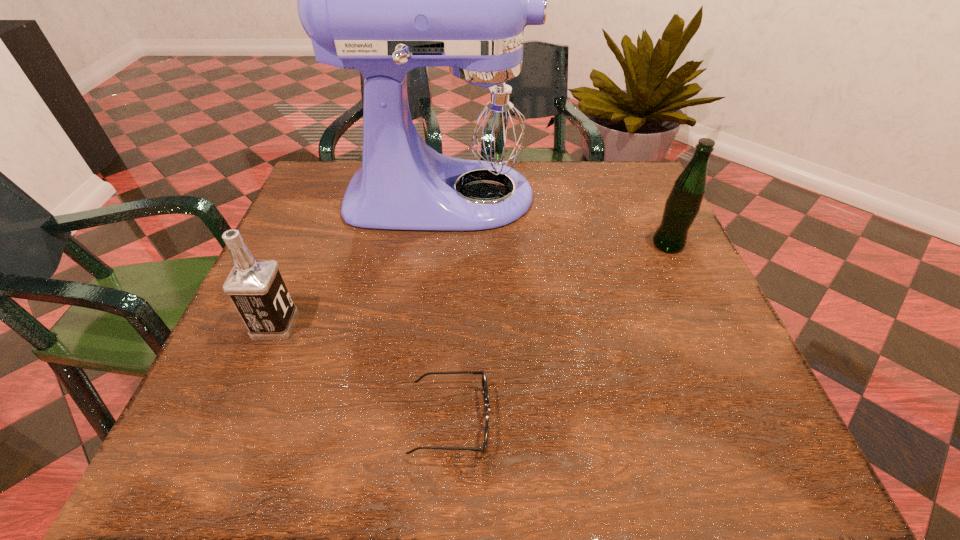
Identify the location of object located in the far edge section of the desktop. This screenshot has height=540, width=960. (383, 0).

Find the location of a particular element. object located in the near edge section of the desktop is located at coordinates (484, 381).

Identify the location of mixer positioned at the left edge. This screenshot has height=540, width=960. (383, 0).

This screenshot has height=540, width=960. What are the coordinates of `vodka present at the left edge` in the screenshot? It's located at point(256,288).

This screenshot has width=960, height=540. In order to click on object present at the right edge in this screenshot , I will do `click(683, 204)`.

Image resolution: width=960 pixels, height=540 pixels. I want to click on object present at the far left corner, so click(383, 0).

You are a GUI agent. You are given a task and a screenshot of the screen. Output one action in this format:
    pyautogui.click(x=<x>, y=<y>)
    Task: Click on the vacant space at the far edge of the desktop
    
    Given the screenshot: What is the action you would take?
    pyautogui.click(x=536, y=195)

In the image, there is a desktop. Where is `vacant space at the near edge`? This screenshot has height=540, width=960. vacant space at the near edge is located at coordinates (647, 445).

Identify the location of free space at the left edge of the desktop. This screenshot has width=960, height=540. (282, 415).

What are the coordinates of `free location at the right edge` in the screenshot? It's located at (648, 287).